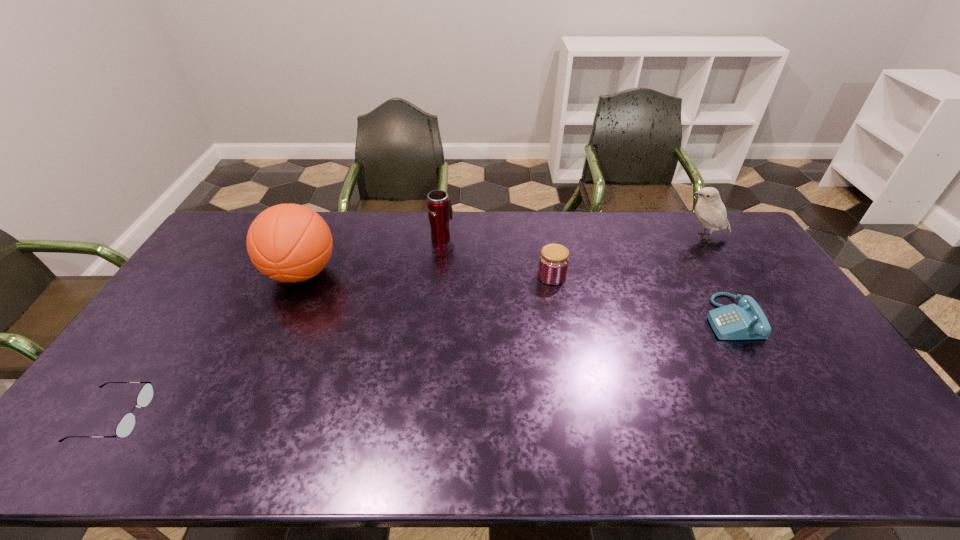
The width and height of the screenshot is (960, 540). What are the coordinates of `vacant space at the left edge of the desktop` in the screenshot? It's located at (126, 364).

In order to click on free region at the right edge of the desktop in this screenshot , I will do `click(780, 292)`.

This screenshot has width=960, height=540. In the image, there is a desktop. In order to click on vacant space at the far left corner in this screenshot , I will do `click(230, 235)`.

At what (x,y) coordinates should I click in order to perform the action: click on free region at the near left corner. Please return your answer as a coordinate pair (x, y). The image size is (960, 540). Looking at the image, I should click on (89, 443).

This screenshot has width=960, height=540. Identify the location of vacant area that lies between the bird and the basketball. (502, 255).

Where is `empty space between the bird and the fifth object from right to left`? empty space between the bird and the fifth object from right to left is located at coordinates (502, 255).

Find the location of a particular element. The height and width of the screenshot is (540, 960). empty space between the bird and the fourth object from left to right is located at coordinates 628,256.

Where is `unoccupied position between the fourth object from left to right and the leftmost object`? unoccupied position between the fourth object from left to right and the leftmost object is located at coordinates (332, 346).

You are a GUI agent. You are given a task and a screenshot of the screen. Output one action in this format:
    pyautogui.click(x=<x>, y=<y>)
    Task: Click on the vacant area that lies between the fourth object from left to right and the third object from left to right
    
    Given the screenshot: What is the action you would take?
    pyautogui.click(x=496, y=256)

The height and width of the screenshot is (540, 960). I want to click on empty space between the tallest object and the leftmost object, so tap(207, 345).